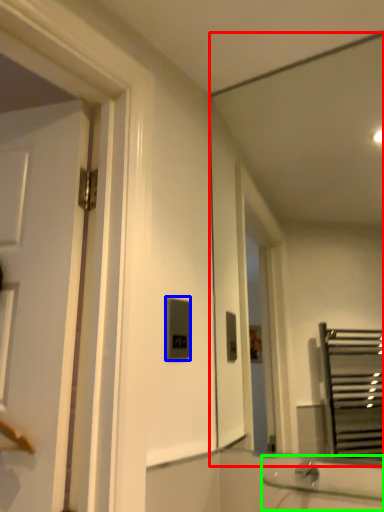
Question: Estimate the real-world distances between objects in this image. Which object is closer to mirror (highlighted by a red box), light switch (highlighted by a blue box) or sink (highlighted by a green box)?

Choices:
 (A) light switch
 (B) sink

Answer: (A)